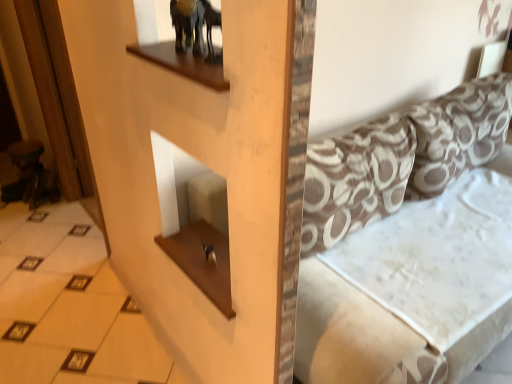
Question: Relative to patterned fabric pillow at right, the 2th pillow positioned from the left, is brown printed fabric pillow at upper right, the first pillow in the left-to-right sequence, in front or behind?

Choices:
 (A) behind
 (B) front

Answer: (B)

Question: From a real-world perspective, is brown printed fabric pillow at upper right, the first pillow in the left-to-right sequence, physically located above or below patterned fabric pillow at right, the 2th pillow positioned from the left?

Choices:
 (A) above
 (B) below

Answer: (B)

Question: Based on their relative distances, which object is farther from the brown printed fabric pillow at upper right, the first pillow in the left-to-right sequence?

Choices:
 (A) white glossy tile at lower left
 (B) patterned fabric couch at center
 (C) patterned fabric pillow at right, which is counted as the 1th pillow, starting from the right

Answer: (A)

Question: Based on their relative distances, which object is nearer to the white glossy tile at lower left?

Choices:
 (A) patterned fabric couch at center
 (B) patterned fabric pillow at right, the 2th pillow positioned from the left
 (C) brown printed fabric pillow at upper right, the first pillow in the left-to-right sequence

Answer: (C)